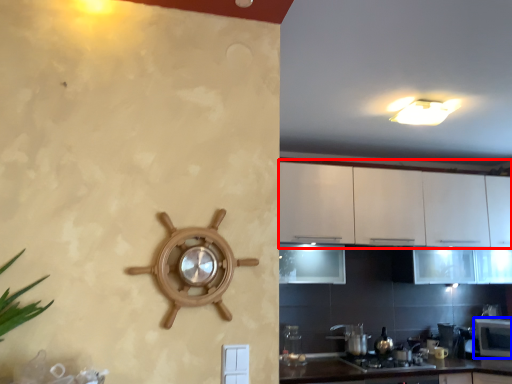
Question: Which object is closer to the camera taking this photo, cabinetry (highlighted by a red box) or microwave (highlighted by a blue box)?

Choices:
 (A) cabinetry
 (B) microwave

Answer: (A)